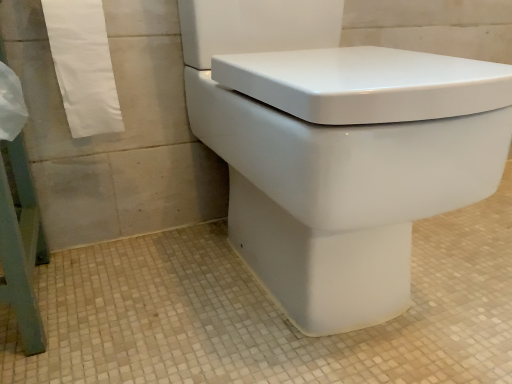
Question: Considering the positions of white glossy toilet at center and white paper towel at left in the image, is white glossy toilet at center taller or shorter than white paper towel at left?

Choices:
 (A) tall
 (B) short

Answer: (A)

Question: Is white glossy toilet at center wider or thinner than white paper towel at left?

Choices:
 (A) thin
 (B) wide

Answer: (B)

Question: Based on their positions, is white glossy toilet at center located to the left or right of white paper towel at left?

Choices:
 (A) right
 (B) left

Answer: (A)

Question: Considering the positions of white paper towel at left and white glossy toilet at center in the image, is white paper towel at left wider or thinner than white glossy toilet at center?

Choices:
 (A) thin
 (B) wide

Answer: (A)

Question: Would you say white paper towel at left is to the left or to the right of white glossy toilet at center in the picture?

Choices:
 (A) right
 (B) left

Answer: (B)

Question: Looking at the image, does white paper towel at left seem bigger or smaller compared to white glossy toilet at center?

Choices:
 (A) small
 (B) big

Answer: (A)

Question: Which is correct: white paper towel at left is inside white glossy toilet at center, or outside of it?

Choices:
 (A) inside
 (B) outside

Answer: (B)